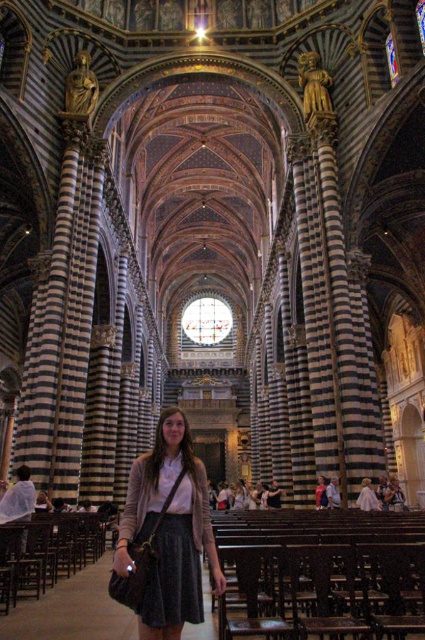
Can you confirm if matte black skirt at center is shorter than matte white dress at center?

No.

Who is more distant from viewer, (167,536) or (376,500)?

Point (376,500)

Is point (178, 422) less distant than point (363, 483)?

Yes.

Image resolution: width=425 pixels, height=640 pixels. In order to click on matte black skirt at center in this screenshot , I will do `click(169, 531)`.